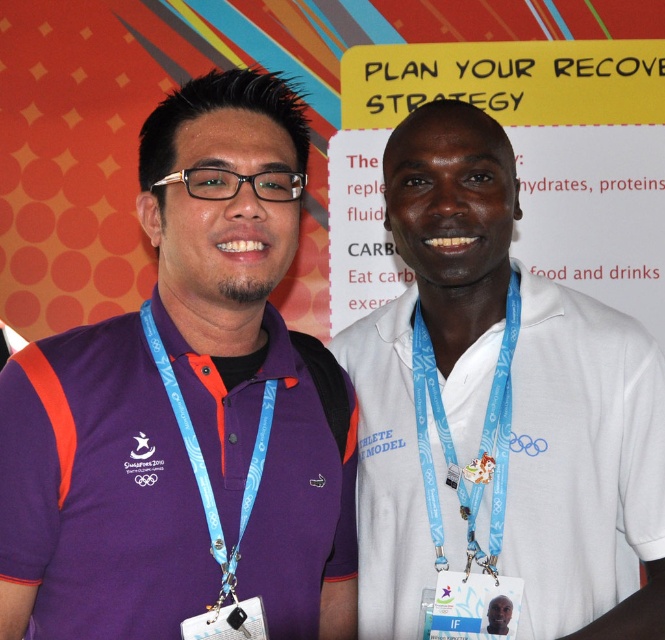
Can you confirm if white matte shirt at center is positioned to the left of light blue fabric lanyard at center?

Incorrect, white matte shirt at center is not on the left side of light blue fabric lanyard at center.

Is point (491, 330) closer to viewer compared to point (466, 474)?

No, (491, 330) is behind (466, 474).

This screenshot has width=665, height=640. What are the coordinates of `white matte shirt at center` in the screenshot? It's located at (497, 404).

Does blue fabric lanyard at left have a lesser width compared to white fabric neck at center?

In fact, blue fabric lanyard at left might be wider than white fabric neck at center.

Is point (198, 458) closer to camera compared to point (428, 339)?

Yes, point (198, 458) is in front of point (428, 339).

Locate an element on the screen. blue fabric lanyard at left is located at coordinates (215, 506).

Is white matte shirt at center thinner than blue fabric lanyard at left?

No.

Who is higher up, white matte shirt at center or blue fabric lanyard at left?

Positioned higher is white matte shirt at center.

Is point (408, 145) more distant than point (269, 428)?

Yes, it is behind point (269, 428).

This screenshot has width=665, height=640. I want to click on white matte shirt at center, so click(497, 404).